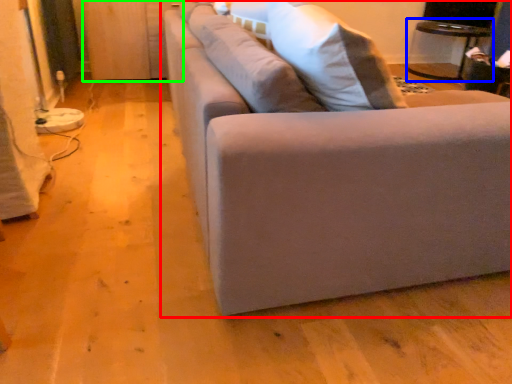
Question: Based on their relative distances, which object is nearer to studio couch (highlighted by a red box)? Choose from table (highlighted by a blue box) and dresser (highlighted by a green box).

Choices:
 (A) table
 (B) dresser

Answer: (B)